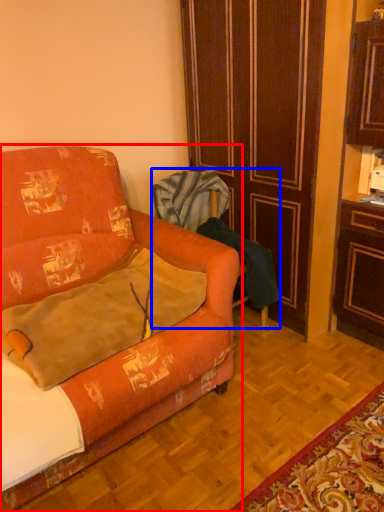
Question: Which point is further to the camera, studio couch (highlighted by a red box) or armchair (highlighted by a blue box)?

Choices:
 (A) studio couch
 (B) armchair

Answer: (B)